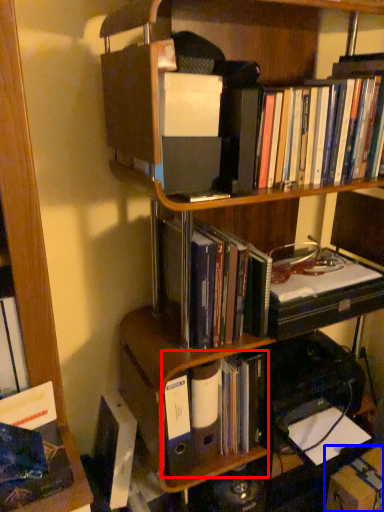
Question: Which point is closer to the camera, book (highlighted by a red box) or cardboard box (highlighted by a blue box)?

Choices:
 (A) book
 (B) cardboard box

Answer: (A)